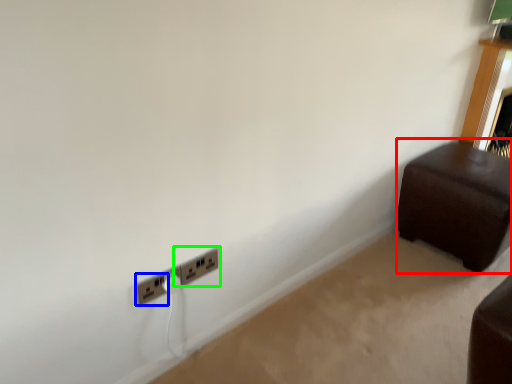
Question: Which is nearer to the furniture (highlighted by a red box)? power plugs and sockets (highlighted by a blue box) or power plugs and sockets (highlighted by a green box).

Choices:
 (A) power plugs and sockets
 (B) power plugs and sockets

Answer: (B)